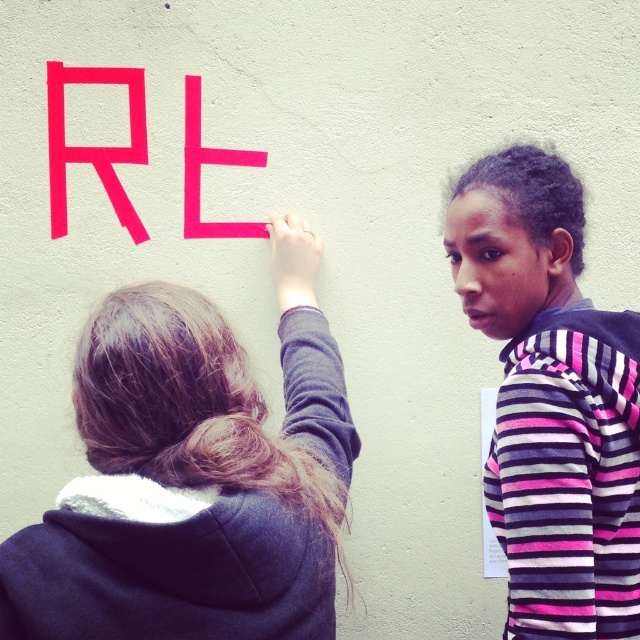
Question: Among these objects, which one is nearest to the camera?

Choices:
 (A) pink matte letter e at upper center
 (B) pink striped hoodie at upper right

Answer: (B)

Question: Where is dark gray hoodie at upper left located in relation to pink matte letter e at upper center in the image?

Choices:
 (A) above
 (B) below

Answer: (B)

Question: Is pink striped hoodie at upper right thinner than pink matte letter e at upper center?

Choices:
 (A) no
 (B) yes

Answer: (A)

Question: Is pink striped hoodie at upper right to the left of pink matte letter r at upper left from the viewer's perspective?

Choices:
 (A) yes
 (B) no

Answer: (B)

Question: Which object is farther from the camera taking this photo?

Choices:
 (A) dark gray hoodie at upper left
 (B) pink matte letter r at upper left
 (C) pink matte letter e at upper center
 (D) pink striped hoodie at upper right

Answer: (C)

Question: Which point is farther to the camera?

Choices:
 (A) dark gray hoodie at upper left
 (B) pink matte letter r at upper left
 (C) pink matte letter e at upper center
 (D) pink striped hoodie at upper right

Answer: (C)